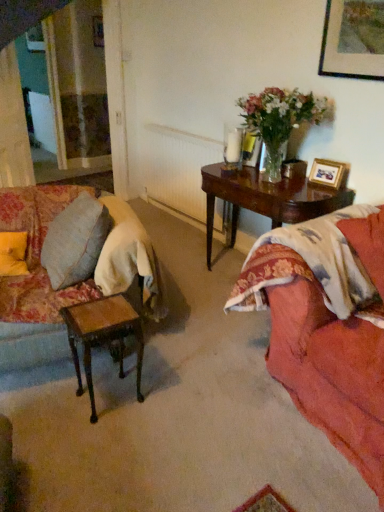
Where is `blank area to the left of wooden picture frame at upper right`? Image resolution: width=384 pixels, height=512 pixels. blank area to the left of wooden picture frame at upper right is located at coordinates click(x=294, y=186).